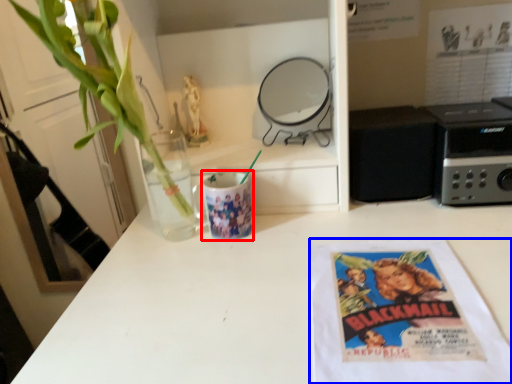
Question: Among these objects, which one is farthest to the camera, mug (highlighted by a red box) or paperback book (highlighted by a blue box)?

Choices:
 (A) mug
 (B) paperback book

Answer: (A)